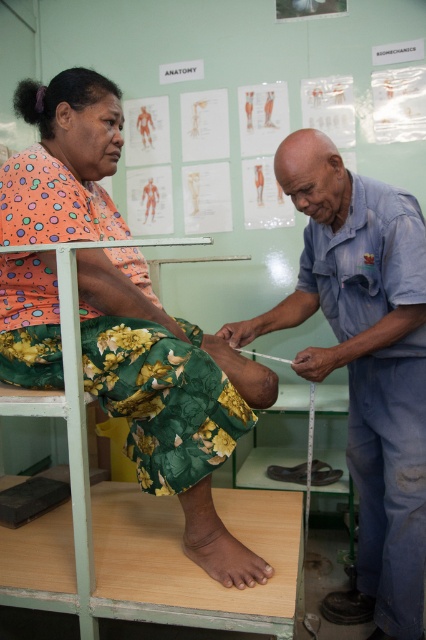
Question: Does green floral skirt at lower left have a greater width compared to blue denim shirt at center?

Choices:
 (A) yes
 (B) no

Answer: (A)

Question: Which object is the farthest from the brown matte skin at lower center?

Choices:
 (A) green floral skirt at lower left
 (B) blue denim shirt at center

Answer: (B)

Question: In this image, where is green floral skirt at lower left located relative to brown matte skin at lower center?

Choices:
 (A) below
 (B) above

Answer: (B)

Question: Is green floral skirt at lower left below blue denim shirt at center?

Choices:
 (A) no
 (B) yes

Answer: (A)

Question: Which of the following is the closest to the observer?

Choices:
 (A) green floral skirt at lower left
 (B) brown matte skin at lower center
 (C) blue denim shirt at center

Answer: (A)

Question: Which point is closer to the camera?

Choices:
 (A) pos(344,168)
 (B) pos(213,522)

Answer: (B)